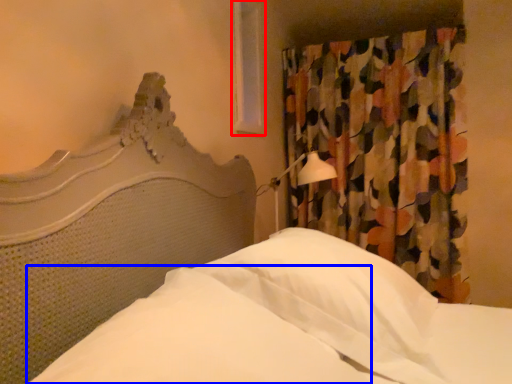
Question: Which of the following is the farthest to the observer, window (highlighted by a red box) or sheet (highlighted by a blue box)?

Choices:
 (A) window
 (B) sheet

Answer: (A)